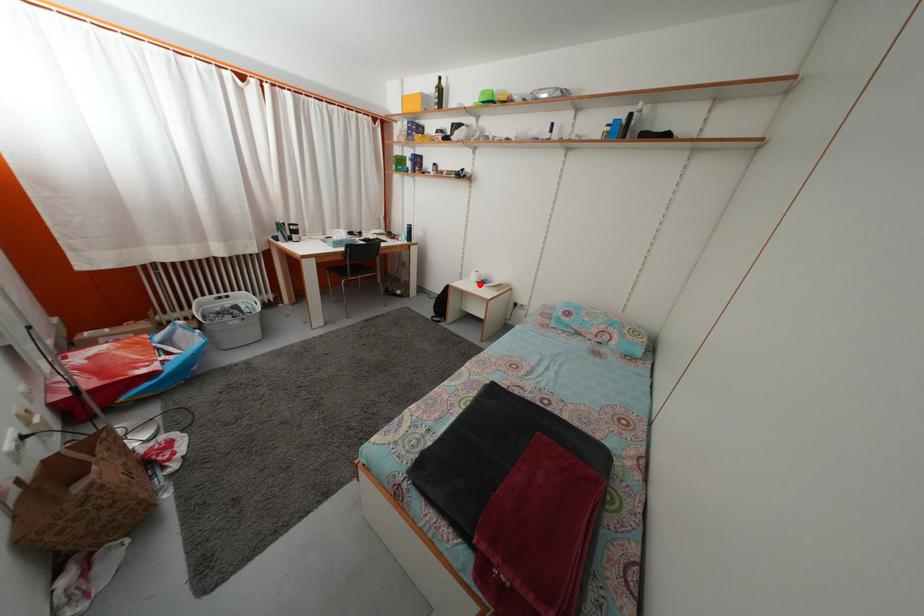
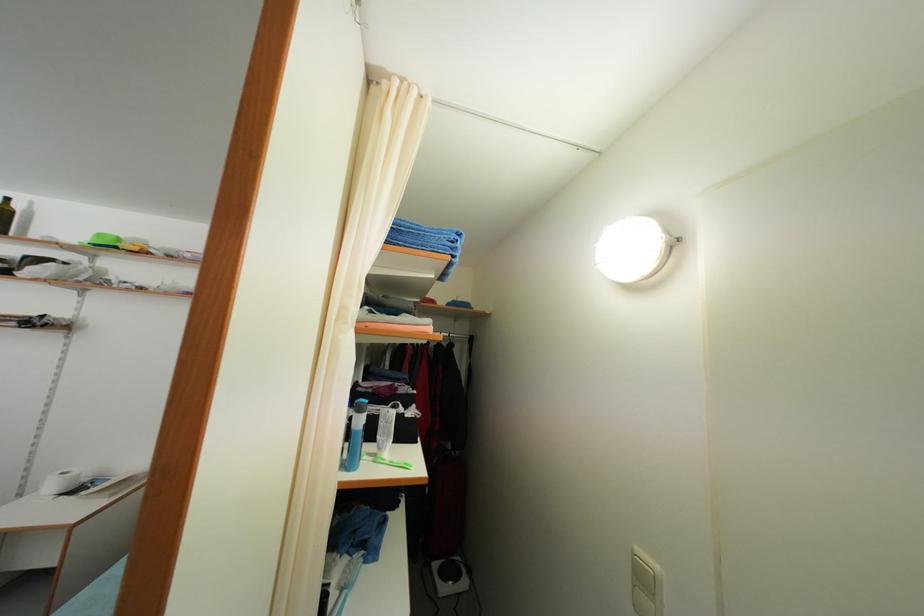
The point at the highlighted location is marked in the first image. Where is the corresponding point in the second image?

(56, 493)